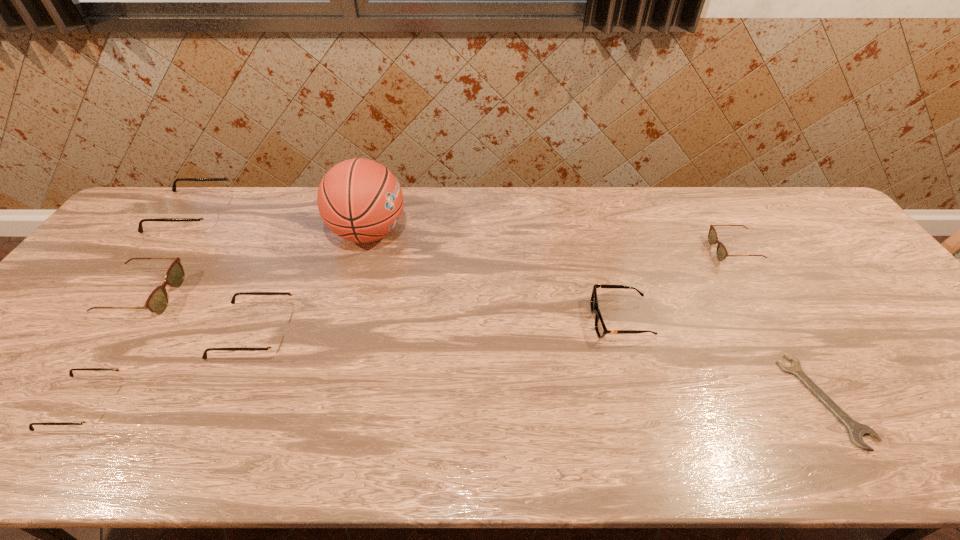
Where is `the smaller brown spectacles`? the smaller brown spectacles is located at coordinates (722, 253).

You are a GUI agent. You are given a task and a screenshot of the screen. Output one action in this format:
    pyautogui.click(x=<x>, y=<y>)
    Task: Click on the nearest black spectacles
    
    Given the screenshot: What is the action you would take?
    pyautogui.click(x=95, y=415)

In order to click on the smallest black spectacles in this screenshot , I will do `click(95, 415)`.

Locate an element on the screen. the shortest object is located at coordinates (856, 430).

This screenshot has width=960, height=540. Find the location of `blank space located on the logo side of the fifth object from left to right`. blank space located on the logo side of the fifth object from left to right is located at coordinates (529, 233).

Image resolution: width=960 pixels, height=540 pixels. Find the location of `vacant area situated at the hinge ends of the biggest black spectacles`. vacant area situated at the hinge ends of the biggest black spectacles is located at coordinates (250, 214).

Locate an element on the screen. The height and width of the screenshot is (540, 960). vacant space situated 0.300m at the front view of the nearer brown spectacles is located at coordinates (285, 296).

Where is `free space located 0.100m at the hinge ends of the fourth spectacles from left to right`? The image size is (960, 540). free space located 0.100m at the hinge ends of the fourth spectacles from left to right is located at coordinates pyautogui.click(x=331, y=333).

The image size is (960, 540). Identify the location of vacant point located on the front-facing side of the third object from right to left. (514, 320).

In order to click on free space located 0.150m on the front-facing side of the third object from right to left in this screenshot , I will do `click(533, 320)`.